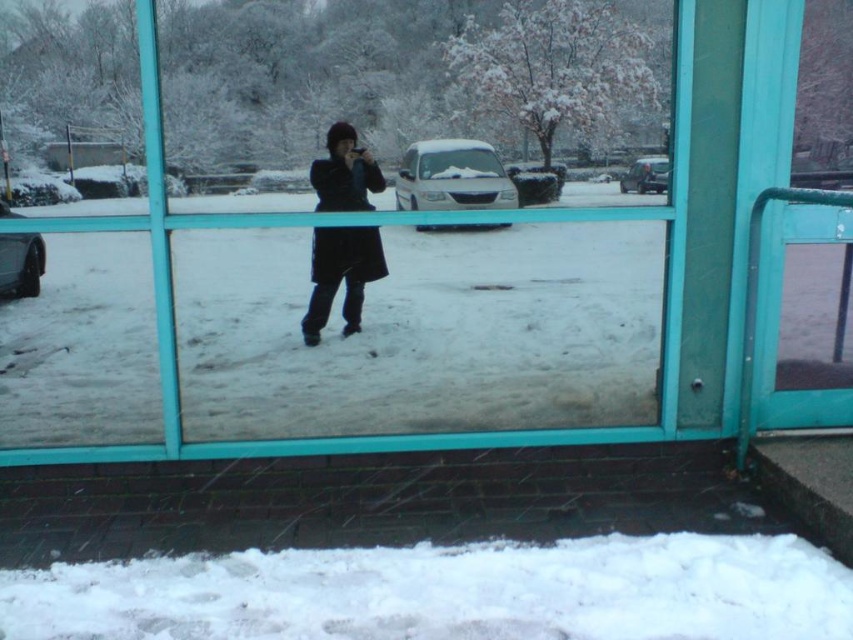
Question: Estimate the real-world distances between objects in this image. Which object is farther from the white fluffy snow at lower center?

Choices:
 (A) black matte coat at center
 (B) clear glass window at center

Answer: (A)

Question: Is clear glass window at center above white fluffy snow at lower center?

Choices:
 (A) no
 (B) yes

Answer: (B)

Question: Which point is farther to the camera?

Choices:
 (A) white fluffy snow at lower center
 (B) clear glass window at center

Answer: (B)

Question: Can you confirm if clear glass window at center is smaller than white fluffy snow at lower center?

Choices:
 (A) yes
 (B) no

Answer: (B)

Question: Is clear glass window at center to the right of black matte coat at center from the viewer's perspective?

Choices:
 (A) yes
 (B) no

Answer: (B)

Question: Which point is farther to the camera?

Choices:
 (A) (350, 572)
 (B) (184, 49)
 (C) (341, 124)

Answer: (C)